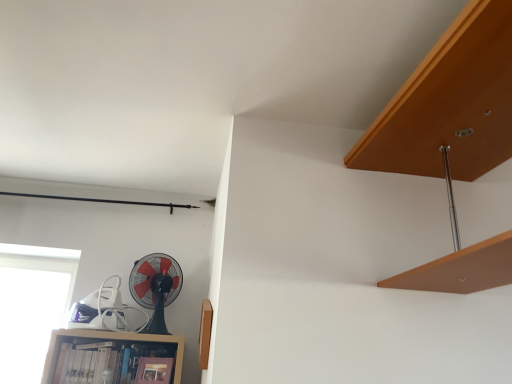
Question: Is black plastic fan at lower left to the right of wooden bookshelf at lower left from the viewer's perspective?

Choices:
 (A) yes
 (B) no

Answer: (A)

Question: Can you confirm if black plastic fan at lower left is taller than wooden bookshelf at lower left?

Choices:
 (A) yes
 (B) no

Answer: (A)

Question: From the image's perspective, is black plastic fan at lower left on top of wooden bookshelf at lower left?

Choices:
 (A) no
 (B) yes

Answer: (B)

Question: Is black plastic fan at lower left in front of wooden bookshelf at lower left?

Choices:
 (A) no
 (B) yes

Answer: (A)

Question: Is black plastic fan at lower left aimed at wooden bookshelf at lower left?

Choices:
 (A) yes
 (B) no

Answer: (B)

Question: Is black plastic fan at lower left bigger than wooden bookshelf at lower left?

Choices:
 (A) no
 (B) yes

Answer: (B)

Question: Can you see wooden bookshelf at lower left touching black plastic fan at lower left?

Choices:
 (A) no
 (B) yes

Answer: (A)

Question: Is wooden bookshelf at lower left positioned beyond the bounds of black plastic fan at lower left?

Choices:
 (A) yes
 (B) no

Answer: (A)

Question: Can you confirm if wooden bookshelf at lower left is thinner than black plastic fan at lower left?

Choices:
 (A) no
 (B) yes

Answer: (B)

Question: Can you confirm if wooden bookshelf at lower left is smaller than black plastic fan at lower left?

Choices:
 (A) no
 (B) yes

Answer: (B)

Question: Is wooden bookshelf at lower left in front of black plastic fan at lower left?

Choices:
 (A) no
 (B) yes

Answer: (B)

Question: Can you confirm if wooden bookshelf at lower left is taller than black plastic fan at lower left?

Choices:
 (A) no
 (B) yes

Answer: (A)

Question: Considering the relative sizes of wooden bookshelf at lower left and transparent glass window at lower left in the image provided, is wooden bookshelf at lower left shorter than transparent glass window at lower left?

Choices:
 (A) no
 (B) yes

Answer: (B)